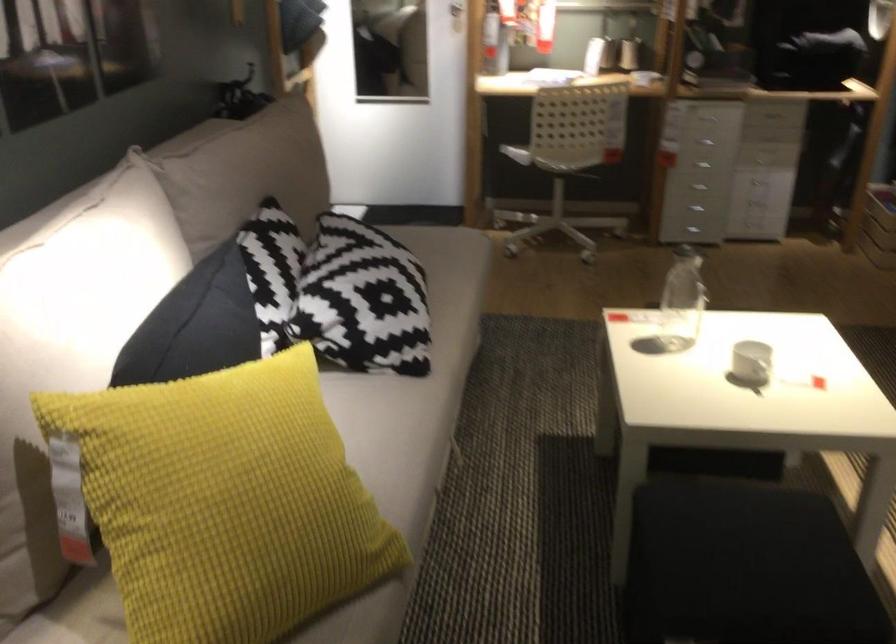
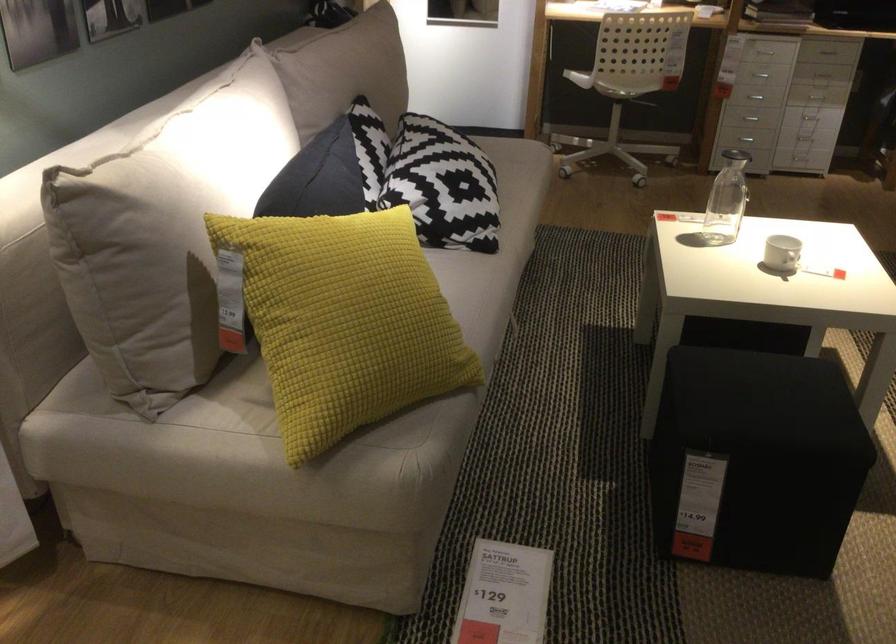
Find the pixel in the second image that matches (707,172) in the first image.

(755, 97)